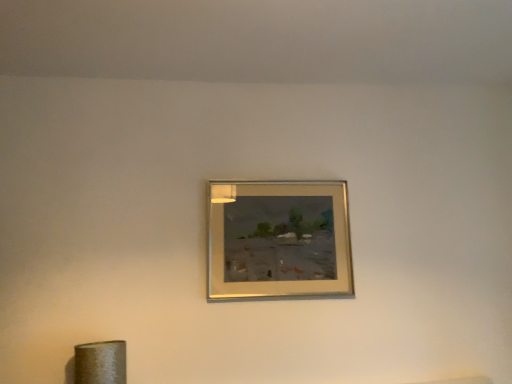
Locate an element on the screen. The height and width of the screenshot is (384, 512). gold metallic picture frame at upper center is located at coordinates (278, 239).

What is the approximate width of gold metallic picture frame at upper center?

It is 1.36 inches.

What do you see at coordinates (278, 239) in the screenshot?
I see `gold metallic picture frame at upper center` at bounding box center [278, 239].

Where is `gold metallic picture frame at upper center`? The height and width of the screenshot is (384, 512). gold metallic picture frame at upper center is located at coordinates pyautogui.click(x=278, y=239).